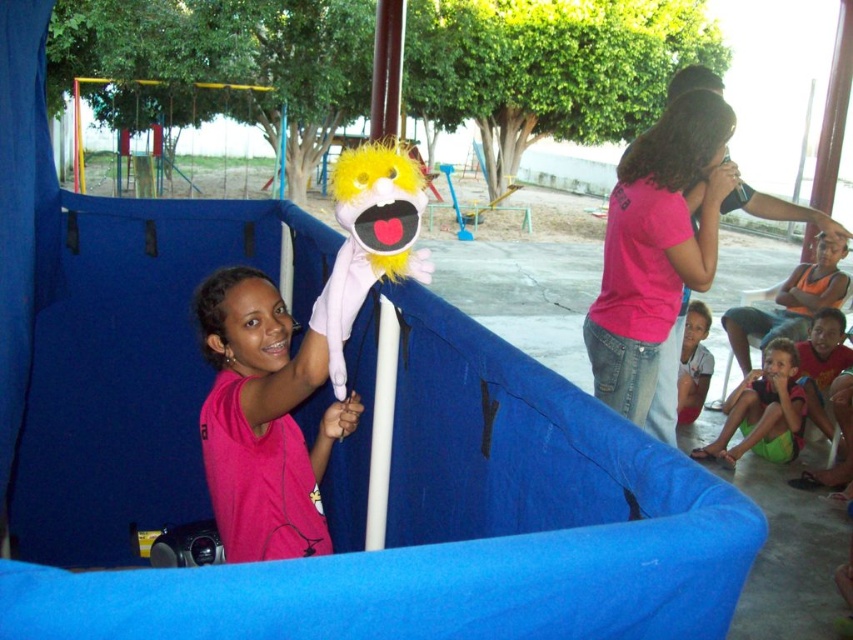
You are a photographer trying to capture a clear photo of the pink matte shirt at center and the green fabric shorts at lower right. Which object should you focus on first if you want to ensure both are in focus, considering their sizes?

The pink matte shirt at center is thinner than the green fabric shorts at lower right, so you should focus on the pink matte shirt at center first to ensure both are in focus.

You are a photographer trying to capture the main performers in the center of the image. The scene has a pink matte shirt at center and a fuzzy yellow puppet at center. Which object should you focus on to ensure the subject takes up most of the frame?

The fuzzy yellow puppet at center occupies more space than the pink matte shirt at center, so focusing on the fuzzy yellow puppet at center will ensure the subject takes up most of the frame.

You are a parent trying to decide whether your child can safely climb onto the blue fabric slide at center while the fuzzy yellow puppet at center is being held up. Based on their heights, can your child reach the top of the slide without needing a step stool?

The blue fabric slide at center is taller than the fuzzy yellow puppet at center. Since the slide is taller, your child may need a step stool to reach the top unless they can reach its height without assistance.